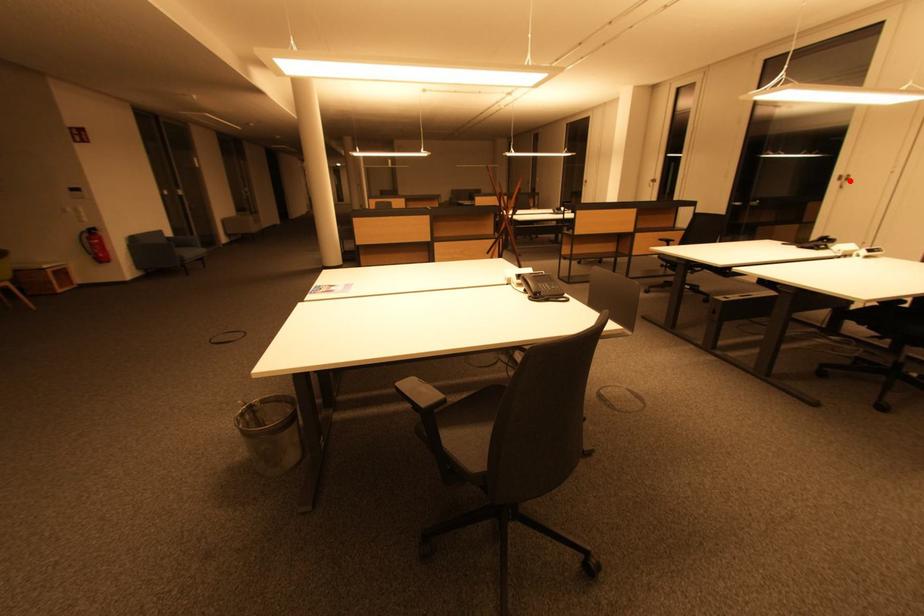
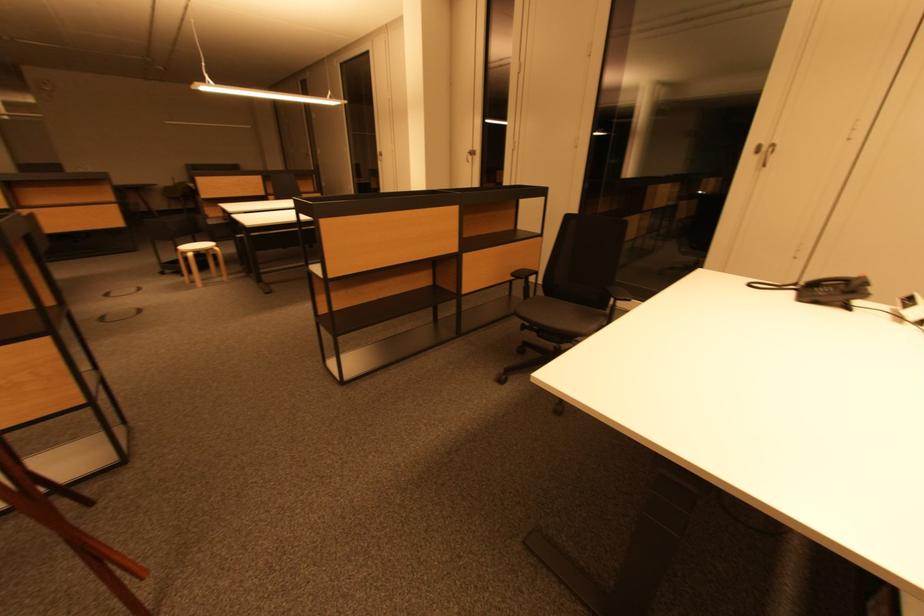
Locate, in the second image, the point that corresponds to the highlighted location in the first image.

(767, 150)